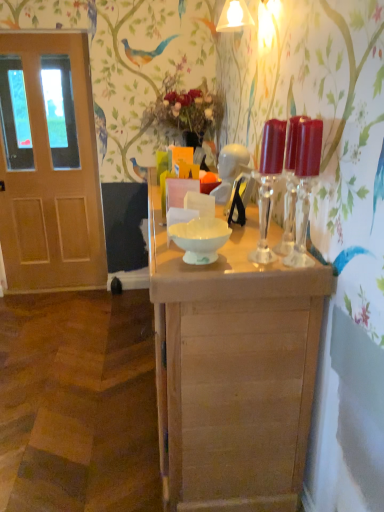
Where is `free point above white glossy bowl at center (from a real-world perspective)`? free point above white glossy bowl at center (from a real-world perspective) is located at coordinates (204, 227).